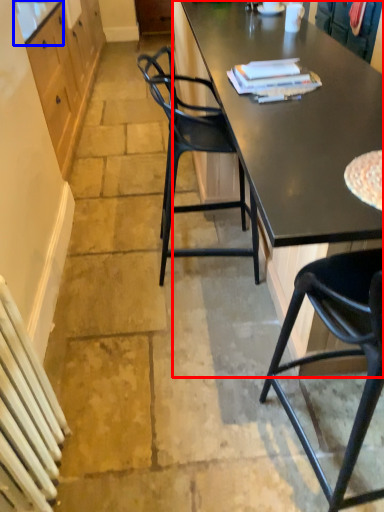
Question: Among these objects, which one is farthest to the camera, desk (highlighted by a red box) or counter top (highlighted by a blue box)?

Choices:
 (A) desk
 (B) counter top

Answer: (B)